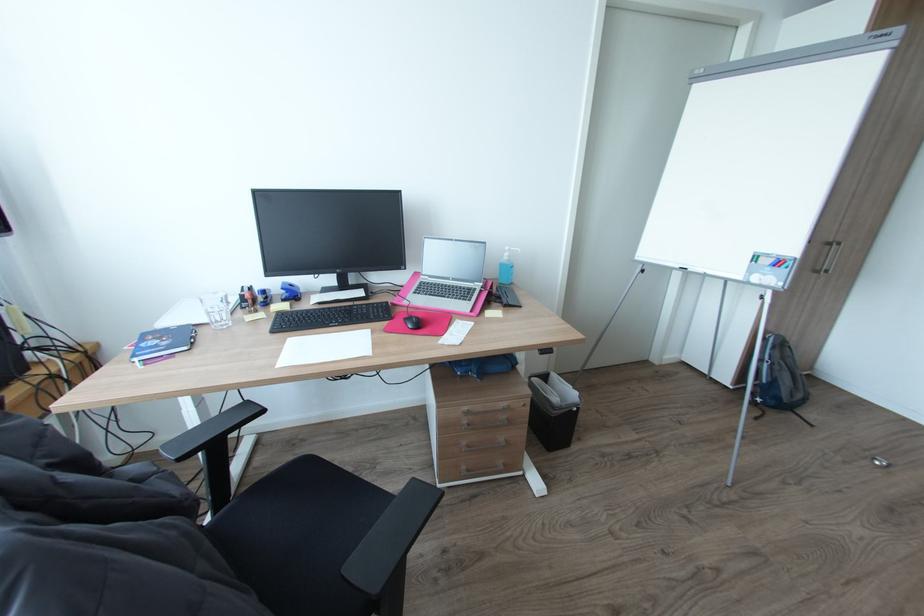
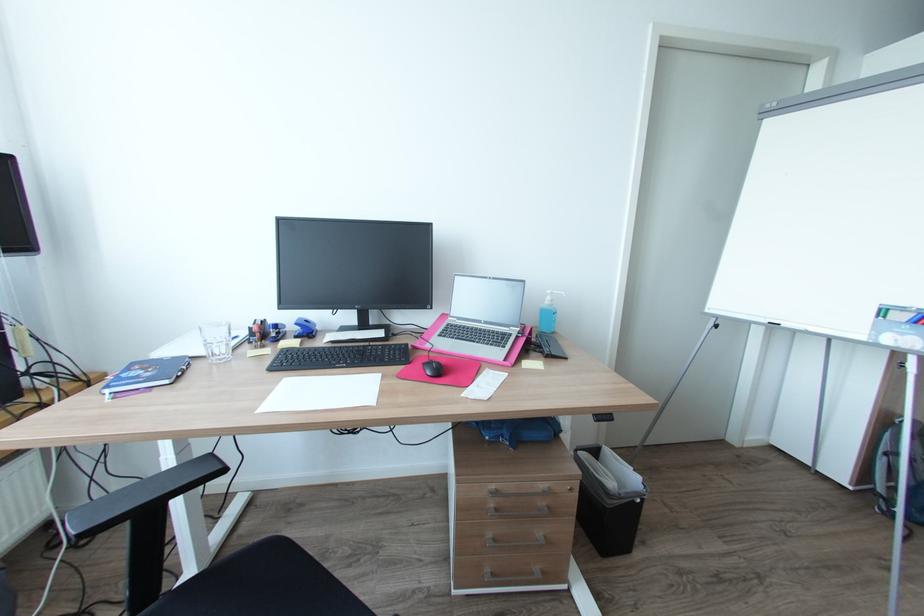
Find the pixel in the second image that matches the point at 289,300 in the first image.

(301, 337)